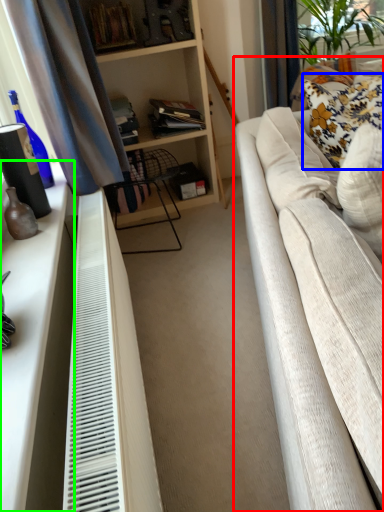
Question: Estimate the real-world distances between objects in this image. Which object is farther from studio couch (highlighted by a red box), pillow (highlighted by a blue box) or dresser (highlighted by a green box)?

Choices:
 (A) pillow
 (B) dresser

Answer: (A)